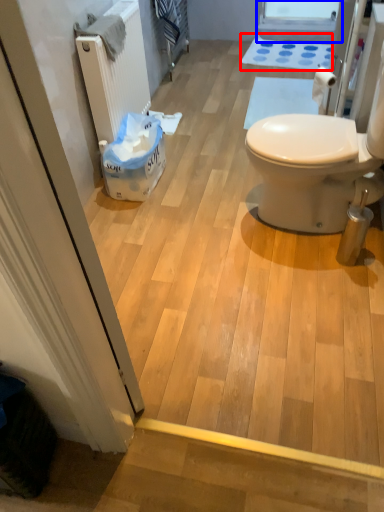
Question: Among these objects, which one is farthest to the camera, bath mat (highlighted by a red box) or window screen (highlighted by a blue box)?

Choices:
 (A) bath mat
 (B) window screen

Answer: (B)